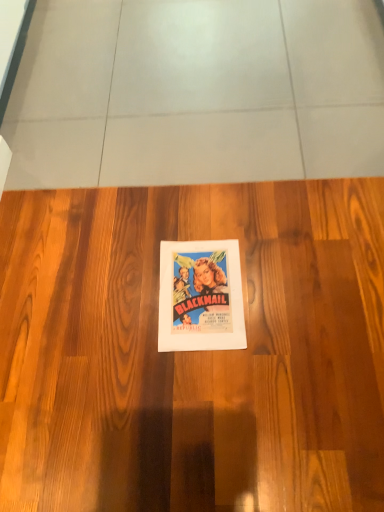
Where is `blank area beneath vibrant paper poster at center (from a real-world perspective)`? The image size is (384, 512). blank area beneath vibrant paper poster at center (from a real-world perspective) is located at coordinates (203, 290).